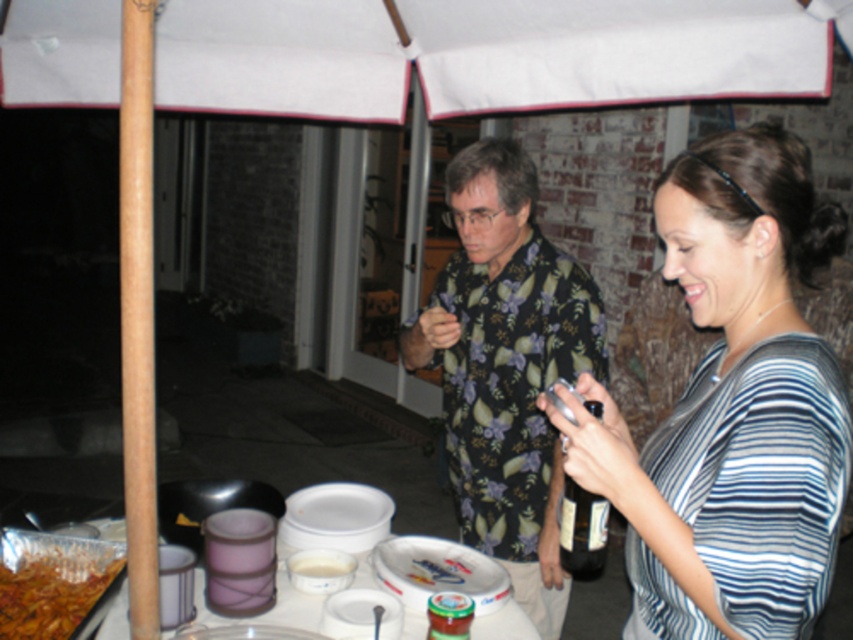
Question: Can you confirm if floral-patterned shirt at center is positioned below white plastic platter at center?

Choices:
 (A) no
 (B) yes

Answer: (A)

Question: Which of the following is the farthest from the observer?

Choices:
 (A) floral-patterned shirt at center
 (B) striped fabric shirt at center
 (C) white plastic platter at center

Answer: (A)

Question: Does striped fabric shirt at center appear on the left side of shiny aluminum foil at lower left?

Choices:
 (A) yes
 (B) no

Answer: (B)

Question: Does floral-patterned shirt at center have a lesser width compared to shiny aluminum foil at lower left?

Choices:
 (A) no
 (B) yes

Answer: (A)

Question: Which of the following is the farthest from the observer?

Choices:
 (A) striped fabric shirt at center
 (B) white plastic platter at center
 (C) shiny aluminum foil at lower left

Answer: (B)

Question: Which of the following is the farthest from the observer?

Choices:
 (A) striped fabric shirt at center
 (B) shiny aluminum foil at lower left

Answer: (B)